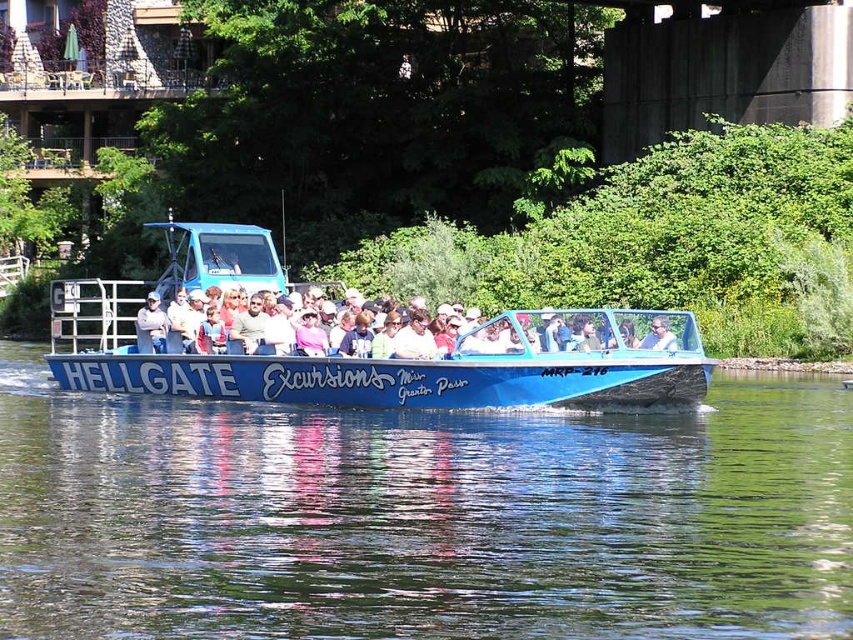
Does blue glossy water at center appear under blue plastic boat at center?

Yes.

Is blue glossy water at center to the left of blue plastic boat at center from the viewer's perspective?

Incorrect, blue glossy water at center is not on the left side of blue plastic boat at center.

Is point (372, 572) in front of point (102, 339)?

Yes.

Identify the location of blue glossy water at center. This screenshot has height=640, width=853. (422, 516).